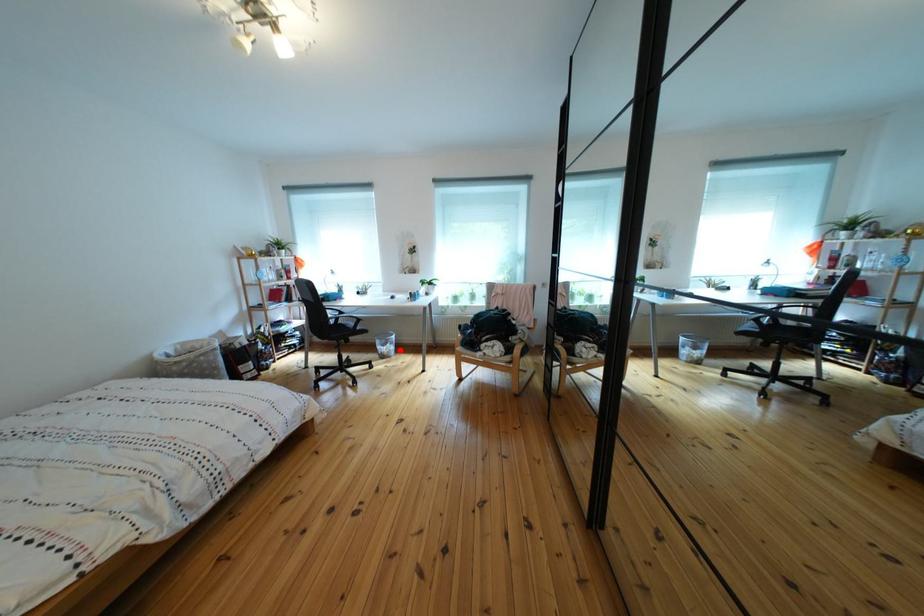
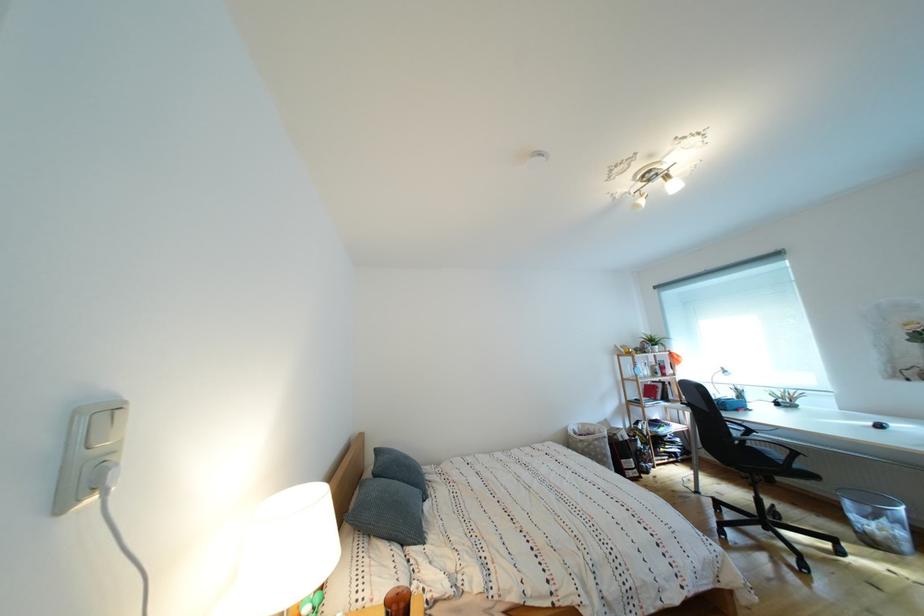
Question: A red point is marked in image1. In image2, is the corresponding 3D point closer to the camera or farther? Reply with the corresponding letter.

Choices:
 (A) The corresponding 3D point is closer.
 (B) The corresponding 3D point is farther.

Answer: (A)